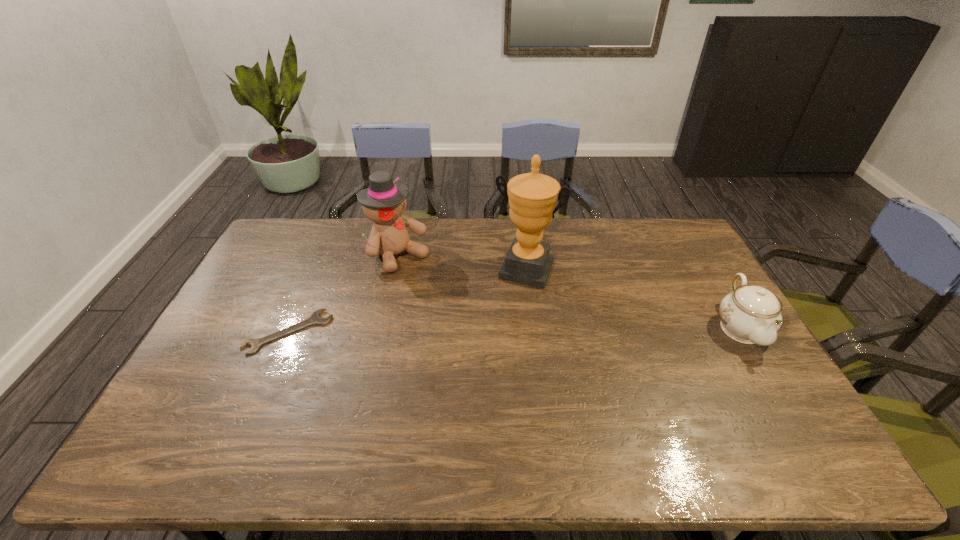
Locate an element on the screen. free space located at the front of the award with handles is located at coordinates 507,315.

Image resolution: width=960 pixels, height=540 pixels. I want to click on vacant region located at the front of the award with handles, so click(502, 326).

This screenshot has width=960, height=540. Find the location of `free spot located 0.270m at the front of the award with handles`. free spot located 0.270m at the front of the award with handles is located at coordinates (493, 348).

This screenshot has height=540, width=960. I want to click on free point located on the front-facing side of the third object from right to left, so click(498, 335).

Image resolution: width=960 pixels, height=540 pixels. In order to click on vacant space located on the front-facing side of the third object from right to left in this screenshot , I will do `click(427, 279)`.

The height and width of the screenshot is (540, 960). I want to click on free spot located on the front-facing side of the third object from right to left, so click(492, 329).

Find the location of a particular element. award that is at the far edge is located at coordinates click(532, 197).

Identify the location of rag_doll present at the far edge. This screenshot has width=960, height=540. (384, 202).

This screenshot has width=960, height=540. What are the coordinates of `object located in the left edge section of the desktop` in the screenshot? It's located at (315, 318).

Identify the location of object that is at the right edge. (750, 314).